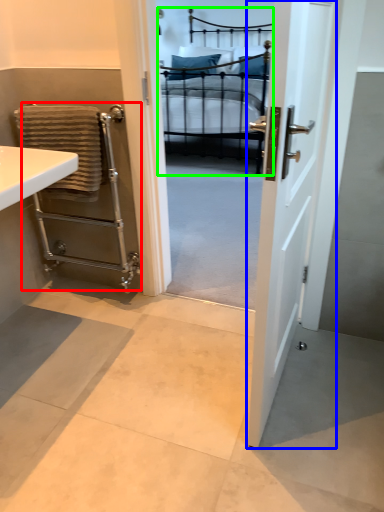
Question: Considering the real-world distances, which object is farthest from balustrade (highlighted by a red box)? door (highlighted by a blue box) or bed (highlighted by a green box)?

Choices:
 (A) door
 (B) bed

Answer: (B)